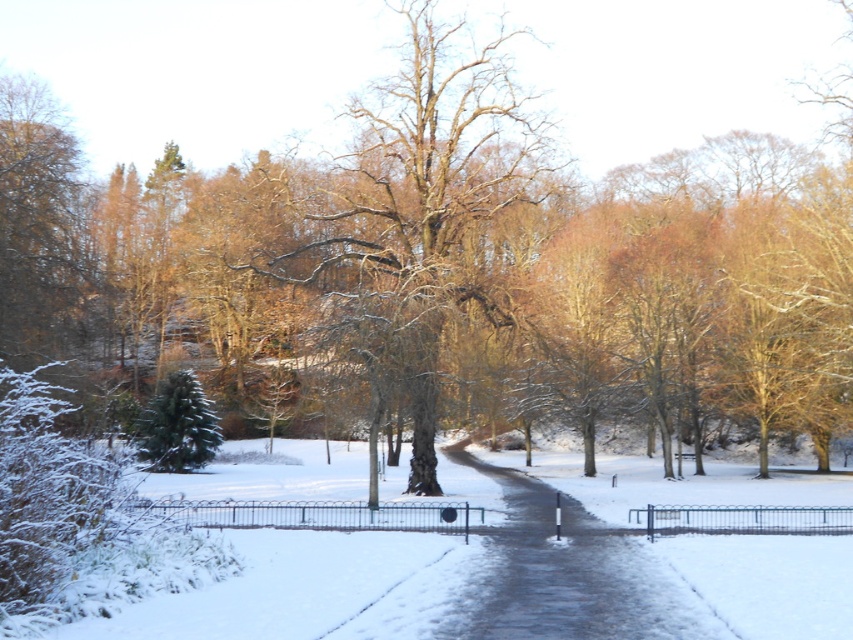
Question: Which of the following is the closest to the observer?

Choices:
 (A) slick asphalt path at center
 (B) bare wood tree at center

Answer: (A)

Question: Does bare wood tree at center appear over slick asphalt path at center?

Choices:
 (A) yes
 (B) no

Answer: (A)

Question: Which of the following is the farthest from the observer?

Choices:
 (A) bare wood tree at center
 (B) slick asphalt path at center

Answer: (A)

Question: From the image, what is the correct spatial relationship of bare wood tree at center in relation to slick asphalt path at center?

Choices:
 (A) left
 (B) right

Answer: (A)

Question: Is bare wood tree at center below slick asphalt path at center?

Choices:
 (A) no
 (B) yes

Answer: (A)